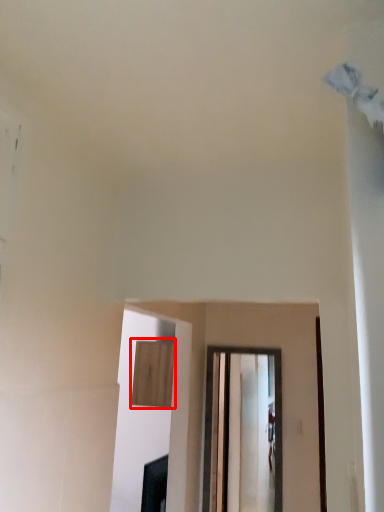
Question: Observing the image, what is the correct spatial positioning of cabinetry (annotated by the red box) in reference to window?

Choices:
 (A) left
 (B) right

Answer: (A)